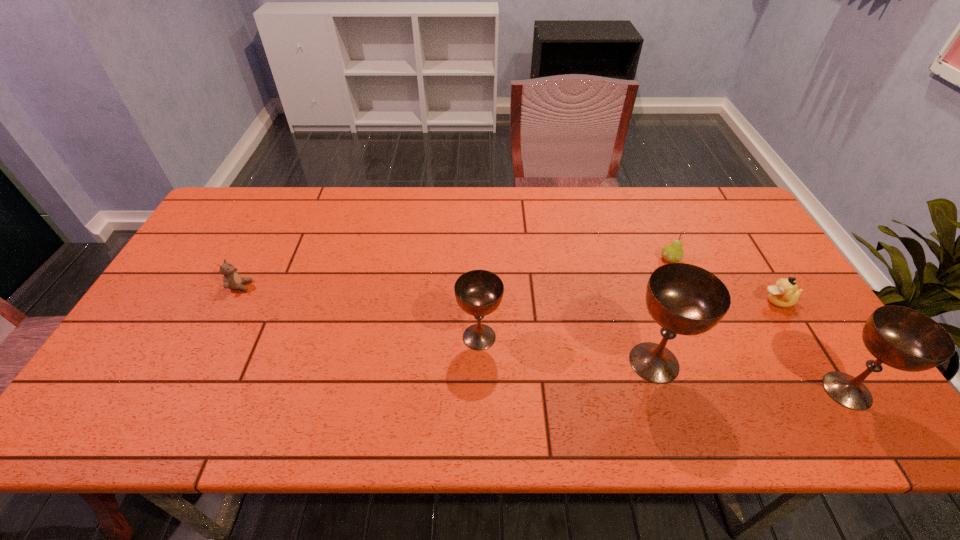
Locate an element on the screen. This screenshot has width=960, height=540. vacant space that satisfies the following two spatial constraints: 1. on the front side of the second chalice from left to right; 2. on the right side of the second object from left to right is located at coordinates (479, 362).